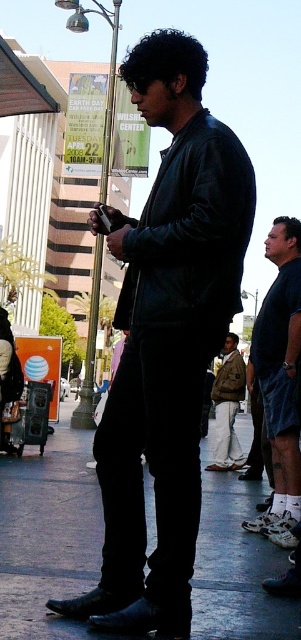
Question: Which object is positioned farthest from the metallic silver awning at upper left?

Choices:
 (A) black leather shoes at lower center
 (B) dark blue jeans at lower right
 (C) matte black jacket at center
 (D) camouflage jacket at center

Answer: (B)

Question: Which point is closer to the camera?

Choices:
 (A) dark blue jeans at lower right
 (B) camouflage jacket at center

Answer: (A)

Question: In this image, where is matte black jacket at center located relative to metallic silver awning at upper left?

Choices:
 (A) above
 (B) below

Answer: (B)

Question: Does matte black jacket at center appear on the left side of metallic silver awning at upper left?

Choices:
 (A) no
 (B) yes

Answer: (A)

Question: Which object is positioned farthest from the dark blue jeans at lower right?

Choices:
 (A) black leather shoes at lower center
 (B) metallic silver awning at upper left

Answer: (B)

Question: Is black leather shoes at lower center positioned at the back of camouflage jacket at center?

Choices:
 (A) yes
 (B) no

Answer: (B)